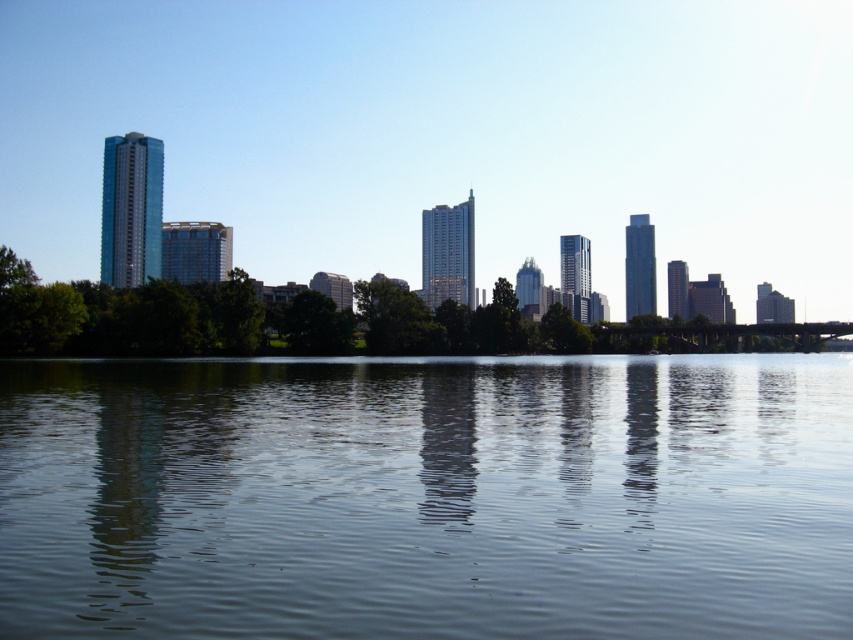
Question: Is clear water at center positioned in front of green leafy tree at center?

Choices:
 (A) no
 (B) yes

Answer: (B)

Question: Is the position of clear water at center less distant than that of green leafy tree at center?

Choices:
 (A) no
 (B) yes

Answer: (B)

Question: Which of the following is the closest to the observer?

Choices:
 (A) green leafy tree at center
 (B) clear water at center

Answer: (B)

Question: Where is clear water at center located in relation to green leafy tree at center in the image?

Choices:
 (A) below
 (B) above

Answer: (A)